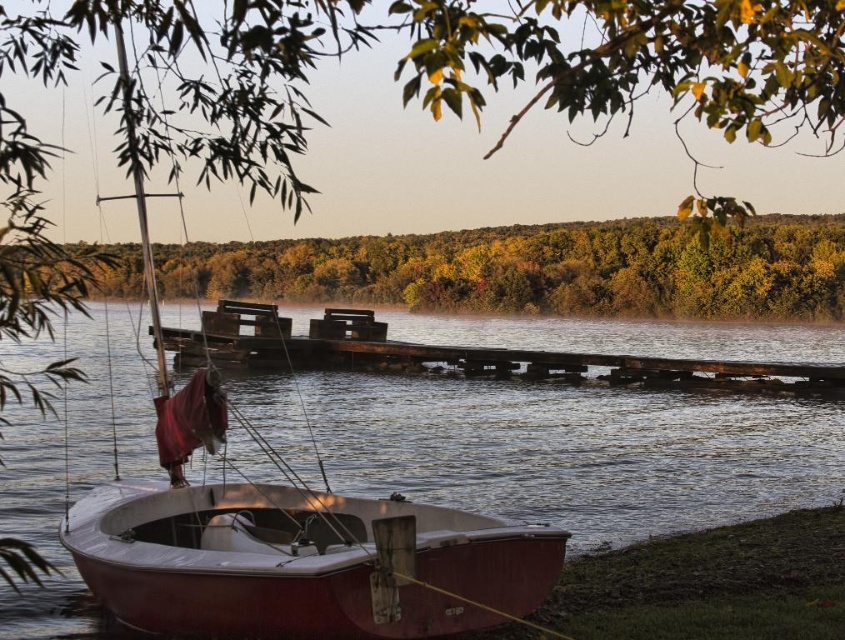
You are an artist planning to paint the lakeside scene. You want to ensure the green leafy tree at upper center and the weathered wood dock at center are proportionally accurate. Which object should you draw wider in your painting?

The green leafy tree at upper center should be drawn wider in the painting since its width is larger than the weathered wood dock at center.